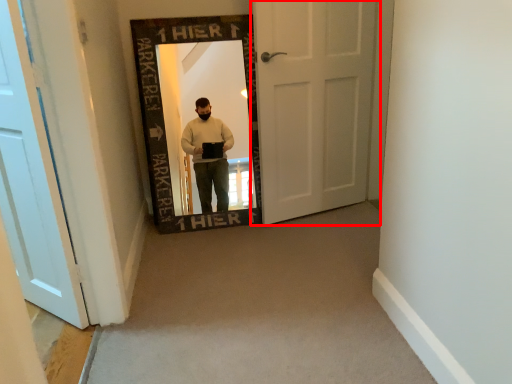
Question: Considering the relative positions of door (annotated by the red box) and door in the image provided, where is door (annotated by the red box) located with respect to the staircase?

Choices:
 (A) left
 (B) right

Answer: (B)